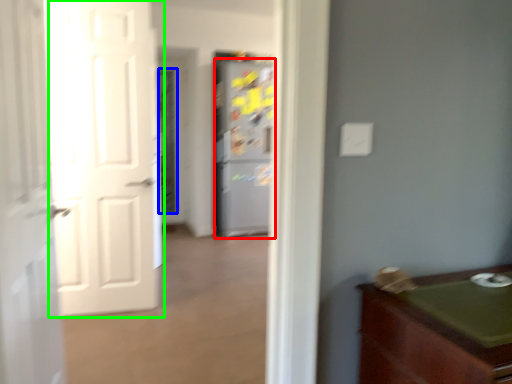
Question: Based on their relative distances, which object is nearer to refrigerator (highlighted by a red box)? Choose from screen door (highlighted by a blue box) and door (highlighted by a green box).

Choices:
 (A) screen door
 (B) door

Answer: (A)